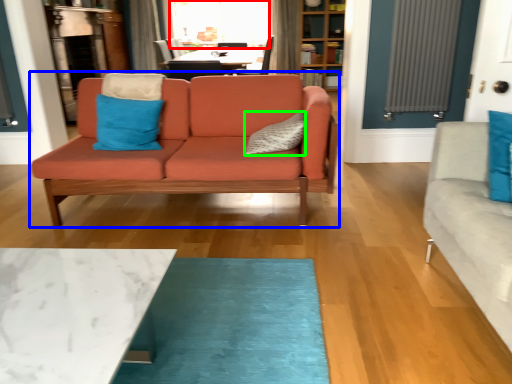
Question: Estimate the real-world distances between objects in this image. Which object is closer to window screen (highlighted by a red box), studio couch (highlighted by a blue box) or pillow (highlighted by a green box)?

Choices:
 (A) studio couch
 (B) pillow

Answer: (A)